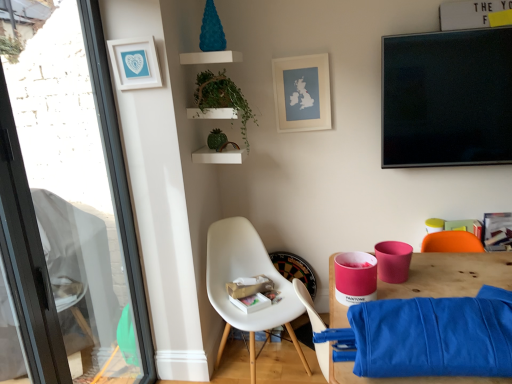
Looking at this image, measure the distance between point [308,98] and camera.

A distance of 2.50 meters exists between point [308,98] and camera.

Find the location of a particular element. The width and height of the screenshot is (512, 384). white matte picture frame at upper left, the second picture frame in the right-to-left sequence is located at coordinates (135, 63).

Measure the distance between point (x=505, y=255) and camera.

Point (x=505, y=255) and camera are 6.17 feet apart from each other.

I want to click on blue fabric at lower right, so 451,275.

Describe the element at coordinates (248, 275) in the screenshot. This screenshot has height=384, width=512. I see `white plastic chair at lower center` at that location.

You are a GUI agent. You are given a task and a screenshot of the screen. Output one action in this format:
    pyautogui.click(x=<x>, y=<y>)
    Task: Click on the transparent glass window at left
    
    Given the screenshot: What is the action you would take?
    pyautogui.click(x=68, y=208)

Identify the location of matte white picture frame at upper center, positioned as the 1th picture frame in back-to-front order. (302, 93).

At what (x,y) coordinates should I click in order to perform the action: click on houseplant positioned vertically above the white plastic chair at lower center (from a real-world perspective). Please return your answer as a coordinate pair (x, y). Image resolution: width=512 pixels, height=384 pixels. Looking at the image, I should click on (223, 98).

Consider the image. Based on their positions, is white plastic chair at lower center located to the left or right of green matte plant at upper center?

Based on their positions, white plastic chair at lower center is located to the right of green matte plant at upper center.

Is white plastic chair at lower center smaller than green matte plant at upper center?

Incorrect, white plastic chair at lower center is not smaller in size than green matte plant at upper center.

From a real-world perspective, is white plastic chair at lower center positioned under green matte plant at upper center based on gravity?

Yes.

Is blue fabric at lower right in contact with white plastic chair at lower center?

blue fabric at lower right and white plastic chair at lower center are clearly separated.

From a real-world perspective, is blue fabric at lower right under white plastic chair at lower center?

Indeed, from a real-world perspective, blue fabric at lower right is positioned beneath white plastic chair at lower center.

From the image's perspective, which object appears higher, blue fabric at lower right or white plastic chair at lower center?

white plastic chair at lower center appears higher in the image.

Looking at this image, could you tell me if transparent glass window at left is turned towards blue fabric at lower right?

Yes, transparent glass window at left faces towards blue fabric at lower right.

Considering the sizes of objects transparent glass window at left and blue fabric at lower right in the image provided, who is smaller, transparent glass window at left or blue fabric at lower right?

Smaller between the two is transparent glass window at left.

Considering the relative sizes of transparent glass window at left and blue fabric at lower right in the image provided, is transparent glass window at left thinner than blue fabric at lower right?

Correct, the width of transparent glass window at left is less than that of blue fabric at lower right.

Is point (414, 381) behind point (322, 63)?

No, it is in front of (322, 63).

In the image, is blue fabric at lower right positioned in front of or behind matte white picture frame at upper center, acting as the second picture frame starting from the left?

Clearly, blue fabric at lower right is in front of matte white picture frame at upper center, acting as the second picture frame starting from the left.

Is blue fabric at lower right positioned beyond the bounds of matte white picture frame at upper center, arranged as the 1th picture frame when viewed from the right?

blue fabric at lower right lies outside matte white picture frame at upper center, arranged as the 1th picture frame when viewed from the right,'s area.

Is the surface of blue fabric at lower right in direct contact with matte white picture frame at upper center, acting as the second picture frame starting from the left?

No, blue fabric at lower right is not beside matte white picture frame at upper center, acting as the second picture frame starting from the left.

Does white plastic chair at lower center appear on the right side of white matte picture frame at upper left, which is the 1th picture frame from left to right?

Yes.

Is white plastic chair at lower center in front of white matte picture frame at upper left, which is the 1th picture frame from left to right?

Yes, white plastic chair at lower center is closer to the camera.

Between point (282, 313) and point (125, 80), which one is positioned behind?

The point (282, 313) is behind.

Can you tell me how much white plastic chair at lower center and white matte picture frame at upper left, the first picture frame viewed from the front, differ in facing direction?

The facing directions of white plastic chair at lower center and white matte picture frame at upper left, the first picture frame viewed from the front, are 42.8 degrees apart.

Which of these two, green matte plant at upper center or transparent glass window at left, is smaller?

With smaller size is green matte plant at upper center.

How many degrees apart are the facing directions of green matte plant at upper center and transparent glass window at left?

0.29 degrees separate the facing orientations of green matte plant at upper center and transparent glass window at left.

Does point (214, 80) appear closer or farther from the camera than point (82, 185)?

Clearly, point (214, 80) is more distant from the camera than point (82, 185).

From the image's perspective, is transparent glass window at left above or below white matte picture frame at upper left, the first picture frame viewed from the front?

transparent glass window at left is below white matte picture frame at upper left, the first picture frame viewed from the front.

Does point (84, 304) come closer to viewer compared to point (123, 55)?

That is False.

Between transparent glass window at left and white matte picture frame at upper left, the first picture frame viewed from the front, which one has less height?

With less height is white matte picture frame at upper left, the first picture frame viewed from the front.

I want to click on chair below the green matte plant at upper center (from the image's perspective), so click(x=248, y=275).

Image resolution: width=512 pixels, height=384 pixels. Identify the location of desk in front of the white plastic chair at lower center. (451, 275).

Estimate the real-world distances between objects in this image. Which object is closer to transparent glass window at left, white plastic chair at lower center or blue fabric at lower right?

Among the two, white plastic chair at lower center is located nearer to transparent glass window at left.

Which object lies nearer to the anchor point matte white picture frame at upper center, acting as the second picture frame starting from the left, transparent glass window at left or blue fabric at lower right?

blue fabric at lower right is positioned closer to the anchor matte white picture frame at upper center, acting as the second picture frame starting from the left.

Based on their spatial positions, is green matte plant at upper center or matte white picture frame at upper center, positioned as the 1th picture frame in back-to-front order, further from white plastic chair at lower center?

matte white picture frame at upper center, positioned as the 1th picture frame in back-to-front order, is positioned further to the anchor white plastic chair at lower center.

Looking at the image, which one is located closer to transparent glass window at left, matte white picture frame at upper center, acting as the second picture frame starting from the left, or white matte picture frame at upper left, the second picture frame from the back?

The object closer to transparent glass window at left is white matte picture frame at upper left, the second picture frame from the back.

Based on their spatial positions, is blue fabric at lower right or matte white picture frame at upper center, arranged as the 1th picture frame when viewed from the right, closer to green matte plant at upper center?

matte white picture frame at upper center, arranged as the 1th picture frame when viewed from the right, is positioned closer to the anchor green matte plant at upper center.

Estimate the real-world distances between objects in this image. Which object is closer to white matte picture frame at upper left, the second picture frame from the back, matte white picture frame at upper center, positioned as the 1th picture frame in back-to-front order, or white plastic chair at lower center?

Among the two, matte white picture frame at upper center, positioned as the 1th picture frame in back-to-front order, is located nearer to white matte picture frame at upper left, the second picture frame from the back.

Which object lies nearer to the anchor point transparent glass window at left, white matte picture frame at upper left, the second picture frame from the back, or blue fabric at lower right?

white matte picture frame at upper left, the second picture frame from the back, is closer to transparent glass window at left.

From the image, which object appears to be farther from matte white picture frame at upper center, arranged as the 1th picture frame when viewed from the right, blue fabric at lower right or white matte picture frame at upper left, the second picture frame in the right-to-left sequence?

Based on the image, blue fabric at lower right appears to be further to matte white picture frame at upper center, arranged as the 1th picture frame when viewed from the right.

I want to click on houseplant between transparent glass window at left and blue fabric at lower right, so pos(223,98).

Find the location of a particular element. The height and width of the screenshot is (384, 512). houseplant between white matte picture frame at upper left, which is the 1th picture frame from left to right, and white plastic chair at lower center vertically is located at coordinates point(223,98).

Where is `window between green matte plant at upper center and white plastic chair at lower center from top to bottom`? The height and width of the screenshot is (384, 512). window between green matte plant at upper center and white plastic chair at lower center from top to bottom is located at coordinates (68, 208).

Where is `window that lies between white matte picture frame at upper left, the second picture frame in the right-to-left sequence, and white plastic chair at lower center from top to bottom`? window that lies between white matte picture frame at upper left, the second picture frame in the right-to-left sequence, and white plastic chair at lower center from top to bottom is located at coordinates (68, 208).